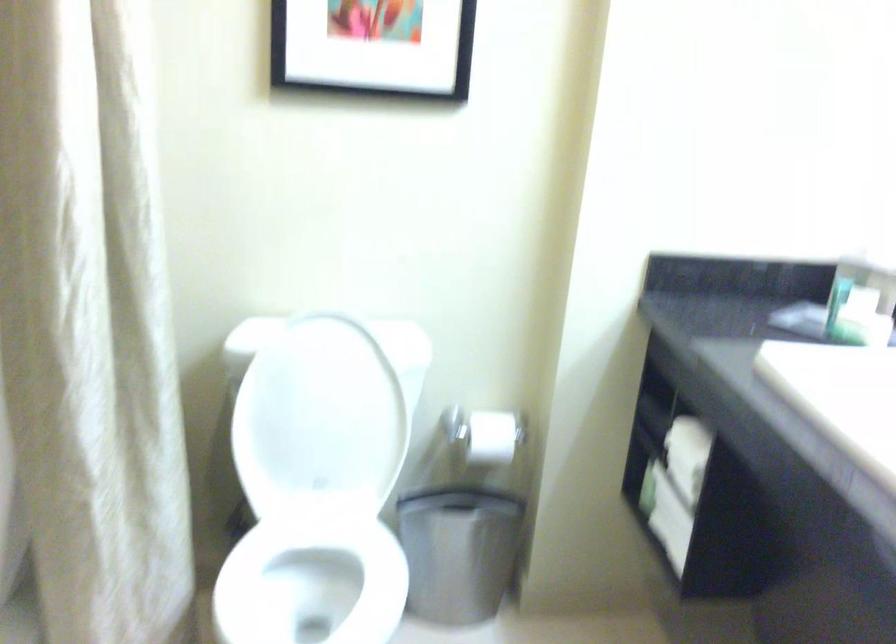
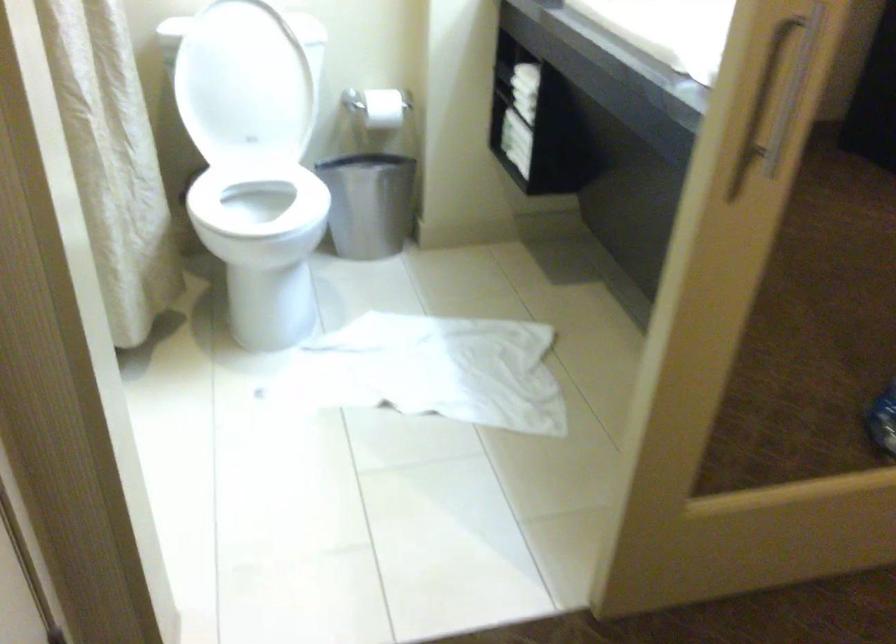
Locate, in the second image, the point that corresponds to [488,444] in the first image.

(383, 108)